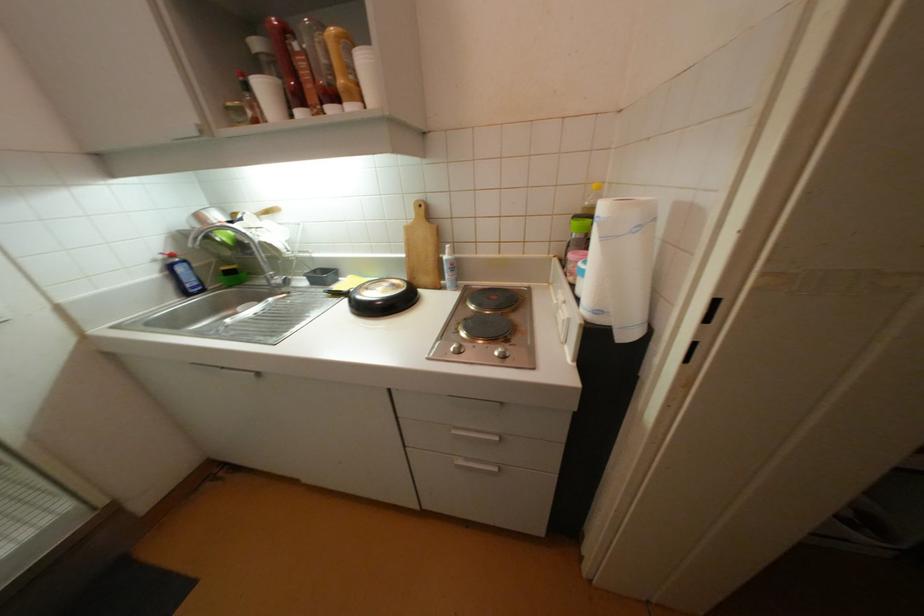
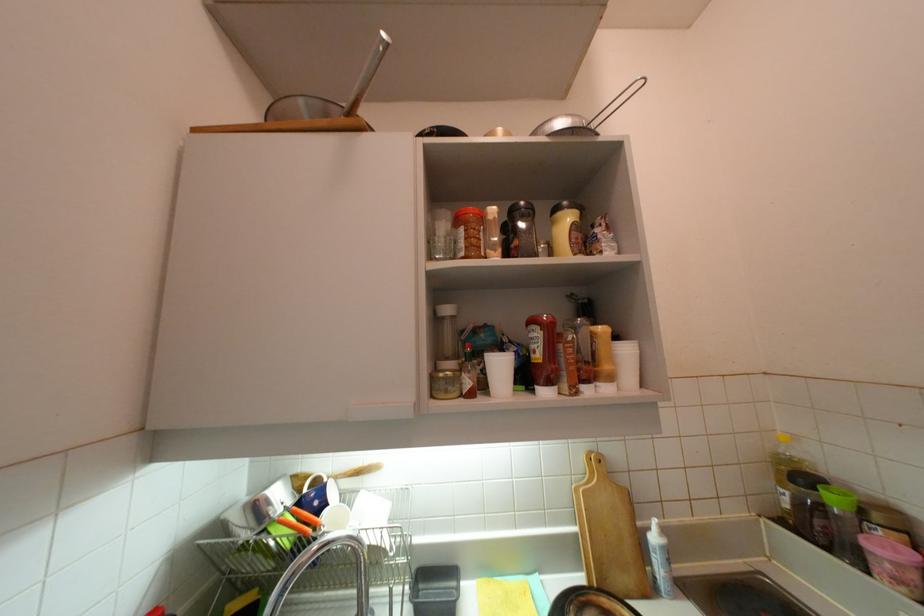
The images are taken continuously from a first-person perspective. In which direction is your viewpoint rotating?

The camera rotated toward right-up.